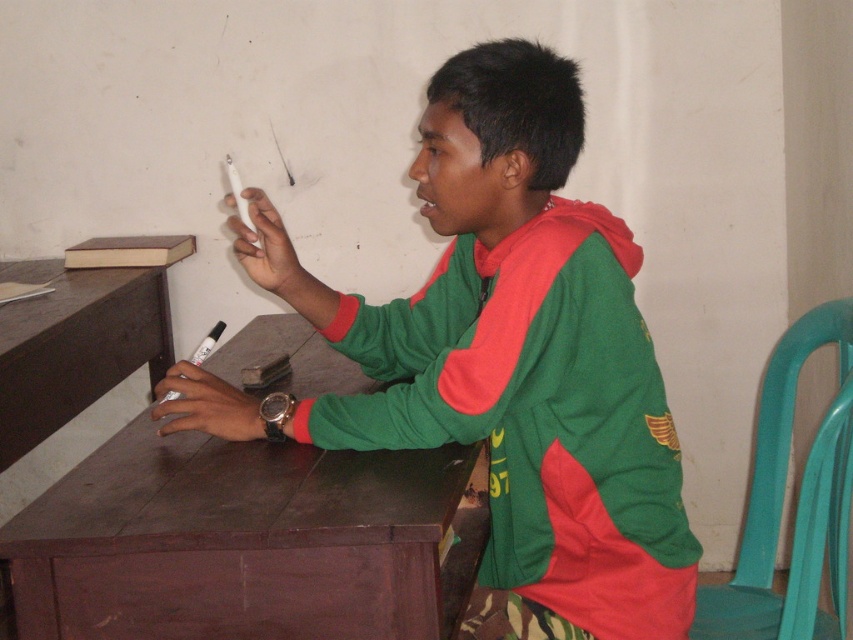
Based on the photo, is brown wood table at center further to camera compared to brown wood table at left?

No, brown wood table at center is in front of brown wood table at left.

Is brown wood table at center bigger than brown wood table at left?

Yes, brown wood table at center is bigger than brown wood table at left.

The image size is (853, 640). I want to click on brown wood table at center, so click(244, 541).

Which is more to the left, green matte jacket at center or brown wood table at left?

From the viewer's perspective, brown wood table at left appears more on the left side.

Is green matte jacket at center shorter than brown wood table at left?

No, green matte jacket at center is not shorter than brown wood table at left.

You are a GUI agent. You are given a task and a screenshot of the screen. Output one action in this format:
    pyautogui.click(x=<x>, y=<y>)
    Task: Click on the green matte jacket at center
    This screenshot has height=640, width=853.
    Given the screenshot: What is the action you would take?
    pyautogui.click(x=502, y=362)

Can you confirm if green matte jacket at center is smaller than brown wood table at center?

Yes.

Does point (550, 380) lie in front of point (85, 614)?

No, (550, 380) is further to viewer.

Image resolution: width=853 pixels, height=640 pixels. I want to click on green matte jacket at center, so click(x=502, y=362).